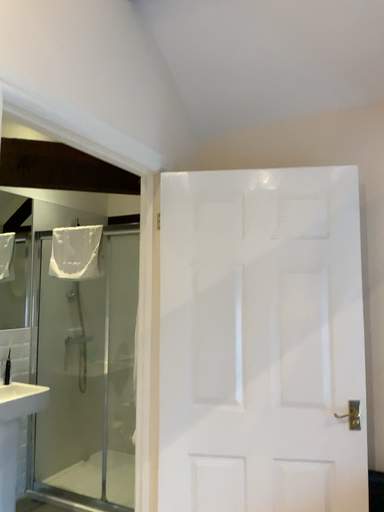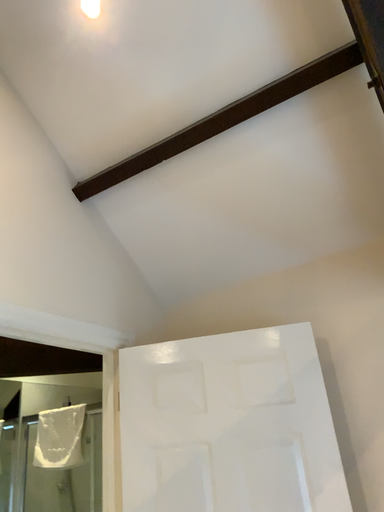
Question: Which way did the camera rotate in the video?

Choices:
 (A) rotated upward
 (B) rotated downward

Answer: (A)